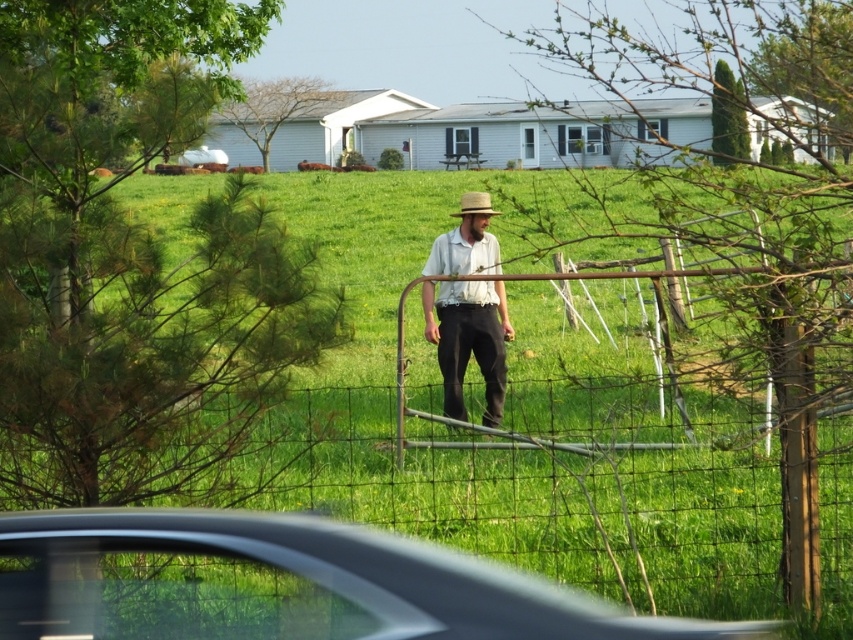
Is green grass at center thinner than light brown straw hat at center?

In fact, green grass at center might be wider than light brown straw hat at center.

Is point (223, 413) in front of point (492, 288)?

Yes.

Identify the location of green grass at center. This screenshot has width=853, height=640. (529, 477).

Can you confirm if green grass at center is positioned to the left of woven straw hat at center?

Yes, green grass at center is to the left of woven straw hat at center.

This screenshot has height=640, width=853. In order to click on green grass at center in this screenshot , I will do `click(529, 477)`.

Which is behind, point (364, 275) or point (479, 195)?

Point (364, 275)

Find the location of a particular element. Image resolution: width=853 pixels, height=640 pixels. green grass at center is located at coordinates (529, 477).

Can you confirm if metallic gray car at lower center is positioned to the right of woven straw hat at center?

In fact, metallic gray car at lower center is to the left of woven straw hat at center.

Which is in front, point (167, 618) or point (490, 204)?

Point (167, 618)

Between point (112, 532) and point (483, 196), which one is positioned behind?

The point (483, 196) is more distant.

Where is `metallic gray car at lower center`? This screenshot has height=640, width=853. metallic gray car at lower center is located at coordinates (283, 582).